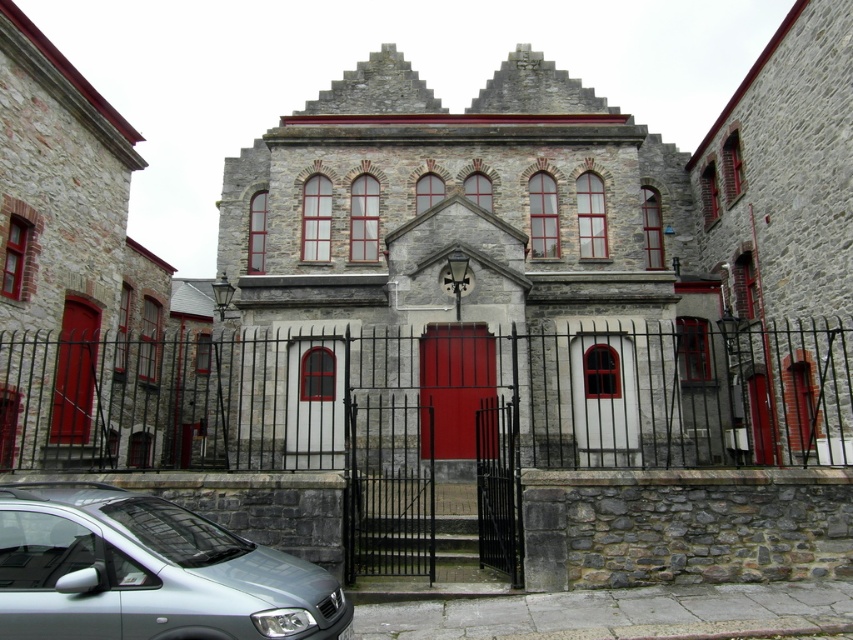
You are standing in front of a stone building with a central section and two wings. You notice a point marked at coordinates [148,572]. What object is located at this point?

The point at coordinates [148,572] is on the satin silver car at lower left.

You are a photographer planning to capture the stone building. You have a satin silver car at lower left and a matte wood door at center in your shot. Which object should you focus on to ensure it takes up more space in the photo?

The satin silver car at lower left has a larger size compared to the matte wood door at center, so focusing on the satin silver car at lower left will ensure it takes up more space in the photo.